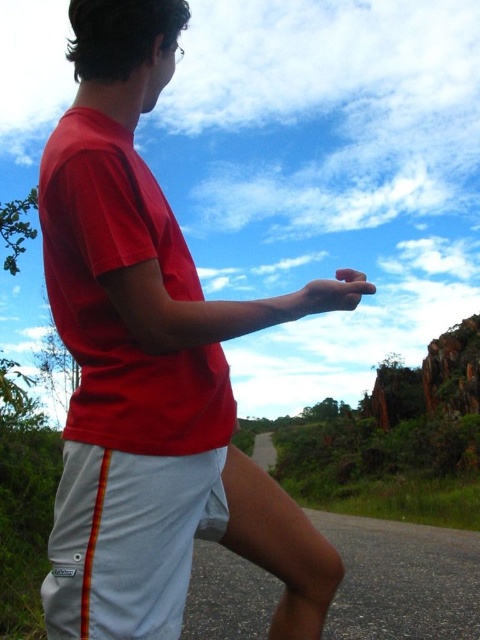
Question: In this image, where is red matte shirt at center located relative to matte red t-shirt at center?

Choices:
 (A) above
 (B) below

Answer: (B)

Question: Considering the real-world distances, which object is farthest from the matte red t-shirt at center?

Choices:
 (A) white cotton shorts at lower center
 (B) red matte shirt at center

Answer: (A)

Question: From the image, what is the correct spatial relationship of matte red t-shirt at center in relation to white cotton shorts at lower center?

Choices:
 (A) left
 (B) right

Answer: (A)

Question: Is matte red t-shirt at center bigger than white cotton shorts at lower center?

Choices:
 (A) yes
 (B) no

Answer: (A)

Question: Which point appears closest to the camera in this image?

Choices:
 (A) (72, 602)
 (B) (134, 65)

Answer: (A)

Question: Which object is closer to the camera taking this photo?

Choices:
 (A) red matte shirt at center
 (B) white cotton shorts at lower center
 (C) matte red t-shirt at center

Answer: (A)